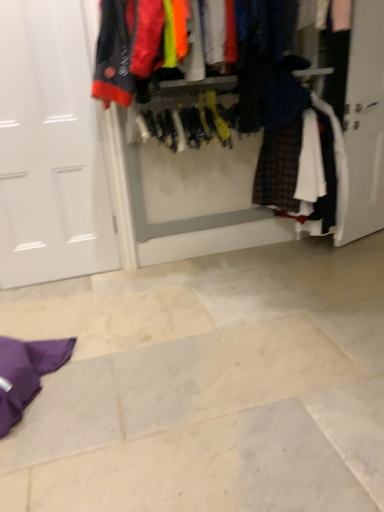
Question: From the image's perspective, is textured fabric closet at center located above white matte door at left?

Choices:
 (A) yes
 (B) no

Answer: (A)

Question: Can you confirm if textured fabric closet at center is taller than white matte door at left?

Choices:
 (A) no
 (B) yes

Answer: (A)

Question: From a real-world perspective, is textured fabric closet at center over white matte door at left?

Choices:
 (A) yes
 (B) no

Answer: (A)

Question: Does textured fabric closet at center contain white matte door at left?

Choices:
 (A) yes
 (B) no

Answer: (B)

Question: From the image's perspective, is textured fabric closet at center under white matte door at left?

Choices:
 (A) yes
 (B) no

Answer: (B)

Question: From a real-world perspective, is textured fabric closet at center under white matte door at left?

Choices:
 (A) no
 (B) yes

Answer: (A)

Question: Can you confirm if white matte door at left is smaller than textured fabric closet at center?

Choices:
 (A) no
 (B) yes

Answer: (B)

Question: Does white matte door at left have a greater height compared to textured fabric closet at center?

Choices:
 (A) yes
 (B) no

Answer: (A)

Question: Can you confirm if white matte door at left is positioned to the left of textured fabric closet at center?

Choices:
 (A) no
 (B) yes

Answer: (B)

Question: Is white matte door at left oriented towards textured fabric closet at center?

Choices:
 (A) yes
 (B) no

Answer: (B)

Question: Does white matte door at left come in front of textured fabric closet at center?

Choices:
 (A) no
 (B) yes

Answer: (A)

Question: Can you confirm if white matte door at left is wider than textured fabric closet at center?

Choices:
 (A) no
 (B) yes

Answer: (A)

Question: Is point (317, 163) positioned closer to the camera than point (31, 222)?

Choices:
 (A) closer
 (B) farther

Answer: (A)